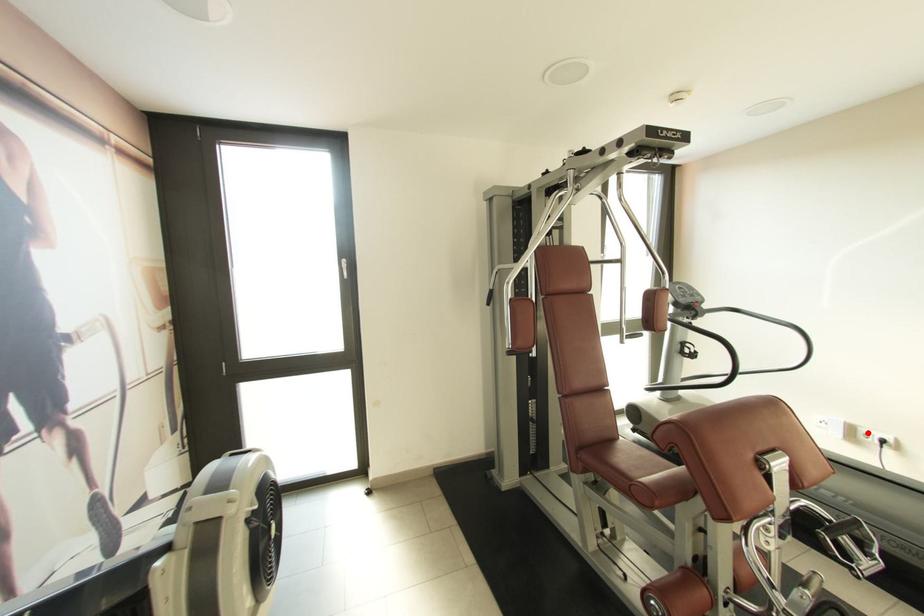
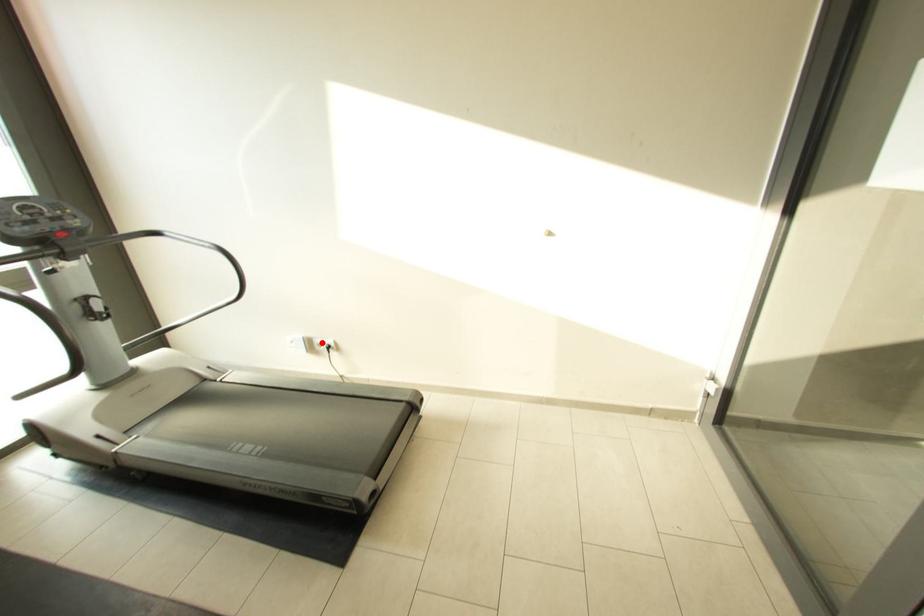
In the scene shown: I am providing you with two images of the same scene from different viewpoints. A red point is marked on the first image and another point is marked on the second image. Is the marked point in image1 the same physical position as the marked point in image2?

Yes